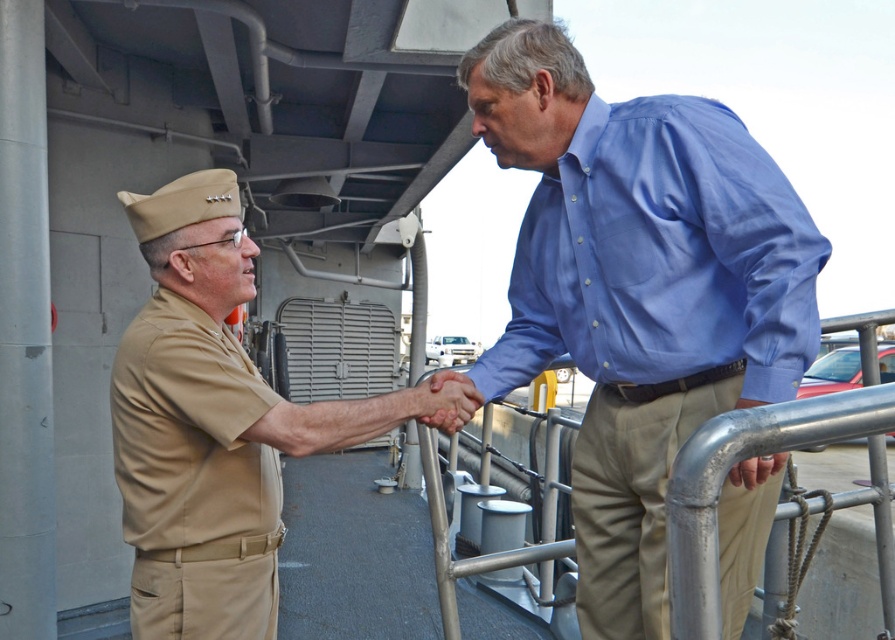
Question: Does khaki uniform at center have a lesser width compared to khaki uniform at left?

Choices:
 (A) no
 (B) yes

Answer: (B)

Question: Which of the following is the closest to the observer?

Choices:
 (A) tan/khaki fabric uniform at left
 (B) khaki uniform at center

Answer: (B)

Question: Does tan/khaki fabric uniform at left appear on the left side of khaki fabric at center?

Choices:
 (A) no
 (B) yes

Answer: (B)

Question: Which object appears closest to the camera in this image?

Choices:
 (A) blue button-up shirt at upper right
 (B) tan/khaki fabric uniform at left
 (C) khaki uniform at center

Answer: (C)

Question: Based on their relative distances, which object is farther from the khaki uniform at left?

Choices:
 (A) khaki fabric at center
 (B) tan/khaki fabric uniform at left

Answer: (A)

Question: Where is blue button-up shirt at upper right located in relation to tan/khaki fabric uniform at left in the image?

Choices:
 (A) above
 (B) below

Answer: (A)